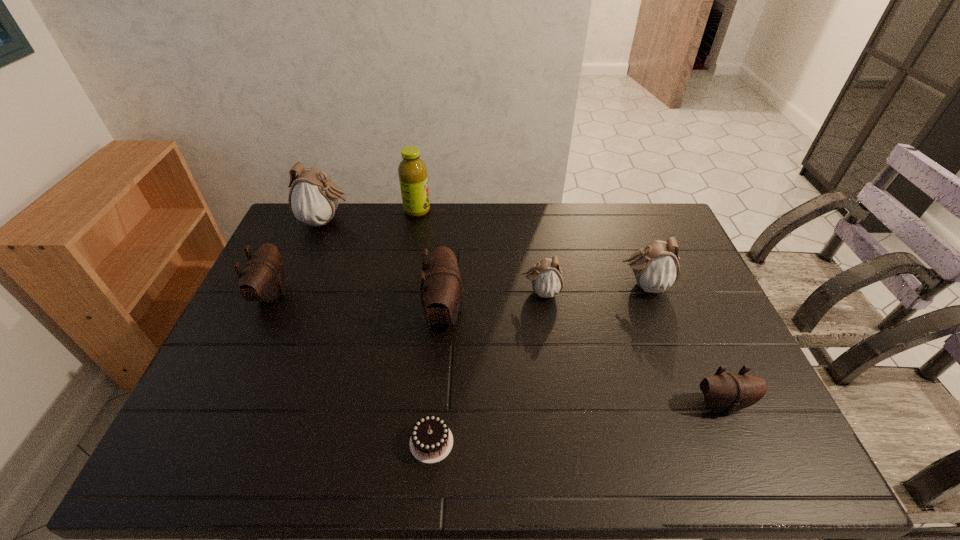
This screenshot has width=960, height=540. Identify the location of vacant area situated 0.270m on the front-facing side of the second white pouch from right to left. (433, 292).

Where is `vacant region located 0.320m on the front-facing side of the second white pouch from right to left`? The height and width of the screenshot is (540, 960). vacant region located 0.320m on the front-facing side of the second white pouch from right to left is located at coordinates (417, 292).

The width and height of the screenshot is (960, 540). I want to click on vacant space situated 0.290m on the front-facing side of the second white pouch from right to left, so click(x=427, y=292).

Locate an element on the screen. This screenshot has width=960, height=540. free location located 0.060m with the flap open on the nearest brown pouch is located at coordinates (738, 442).

The height and width of the screenshot is (540, 960). I want to click on blank area located 0.310m on the left of the nearest object, so click(x=275, y=442).

The image size is (960, 540). Find the location of `fruit juice present at the far edge`. fruit juice present at the far edge is located at coordinates (412, 171).

I want to click on pouch situated at the far edge, so click(313, 199).

The image size is (960, 540). Identify the location of object that is at the near edge. (431, 441).

Locate an element on the screen. The height and width of the screenshot is (540, 960). object that is at the far left corner is located at coordinates (313, 199).

I want to click on vacant region at the far edge of the desktop, so click(397, 234).